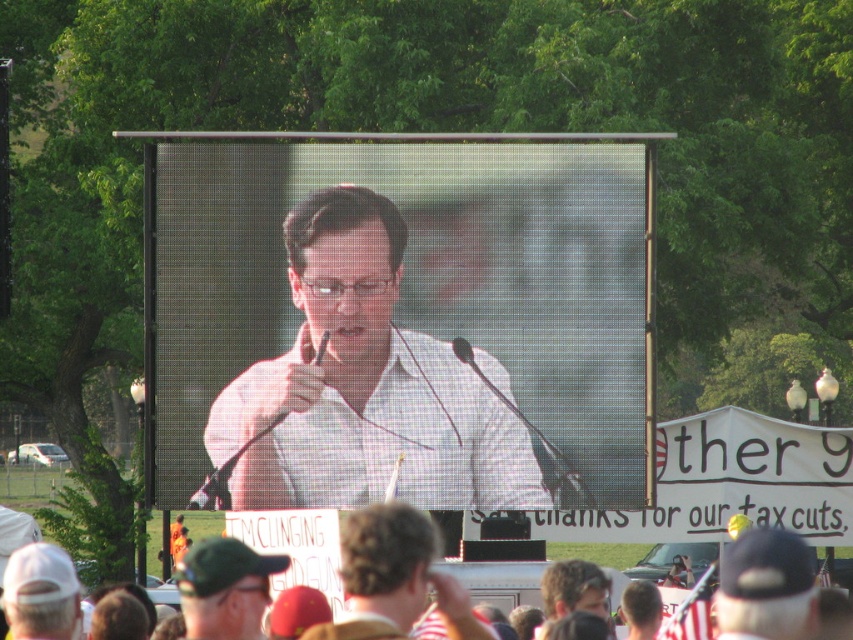
Question: Is white checkered shirt at center bigger than green cap at center?

Choices:
 (A) yes
 (B) no

Answer: (B)

Question: Among these points, which one is nearest to the camera?

Choices:
 (A) (204, 563)
 (B) (456, 452)
 (C) (397, 513)
 (D) (548, 582)

Answer: (A)

Question: Can you confirm if brown hair at center is smaller than green cap at center?

Choices:
 (A) yes
 (B) no

Answer: (A)

Question: Does white checkered shirt at center appear on the left side of brown hair at center?

Choices:
 (A) yes
 (B) no

Answer: (A)

Question: Which object is positioned closest to the brown hair at center?

Choices:
 (A) green cap at center
 (B) smooth brown hair at center
 (C) white checkered shirt at center

Answer: (A)

Question: Which of the following is the closest to the observer?

Choices:
 (A) (583, 602)
 (B) (195, 563)
 (C) (474, 636)
 (D) (305, 244)

Answer: (C)